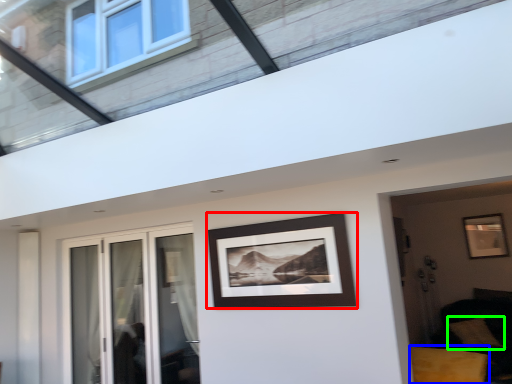
Question: Which is nearer to the picture frame (highlighted by a red box)? furniture (highlighted by a blue box) or pillow (highlighted by a green box).

Choices:
 (A) furniture
 (B) pillow

Answer: (A)